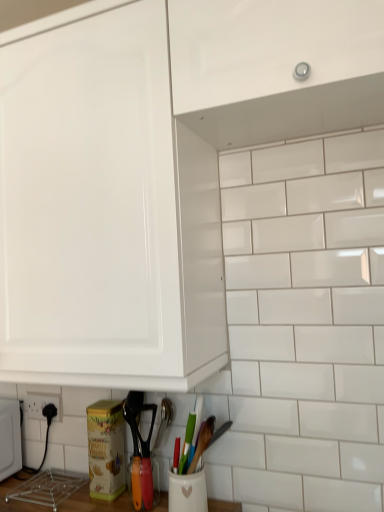
Question: Is wooden spatula at lower center beside black plastic electric outlet at lower left?

Choices:
 (A) no
 (B) yes

Answer: (A)

Question: Can you confirm if wooden spatula at lower center is wider than black plastic electric outlet at lower left?

Choices:
 (A) yes
 (B) no

Answer: (A)

Question: Can you confirm if wooden spatula at lower center is taller than black plastic electric outlet at lower left?

Choices:
 (A) no
 (B) yes

Answer: (B)

Question: From a real-world perspective, is wooden spatula at lower center below black plastic electric outlet at lower left?

Choices:
 (A) no
 (B) yes

Answer: (B)

Question: Is wooden spatula at lower center facing towards black plastic electric outlet at lower left?

Choices:
 (A) no
 (B) yes

Answer: (A)

Question: Does wooden spatula at lower center have a lesser width compared to black plastic electric outlet at lower left?

Choices:
 (A) yes
 (B) no

Answer: (B)

Question: Can you confirm if glossy white cabinet at upper center is taller than black plastic electric outlet at lower left?

Choices:
 (A) no
 (B) yes

Answer: (B)

Question: Does glossy white cabinet at upper center have a larger size compared to black plastic electric outlet at lower left?

Choices:
 (A) yes
 (B) no

Answer: (A)

Question: From a real-world perspective, is glossy white cabinet at upper center physically below black plastic electric outlet at lower left?

Choices:
 (A) no
 (B) yes

Answer: (A)

Question: Does glossy white cabinet at upper center turn towards black plastic electric outlet at lower left?

Choices:
 (A) no
 (B) yes

Answer: (A)

Question: Is glossy white cabinet at upper center touching black plastic electric outlet at lower left?

Choices:
 (A) no
 (B) yes

Answer: (A)

Question: Is glossy white cabinet at upper center turned away from black plastic electric outlet at lower left?

Choices:
 (A) no
 (B) yes

Answer: (A)

Question: Is black plastic electric outlet at lower left shorter than glossy white cabinet at upper center?

Choices:
 (A) yes
 (B) no

Answer: (A)